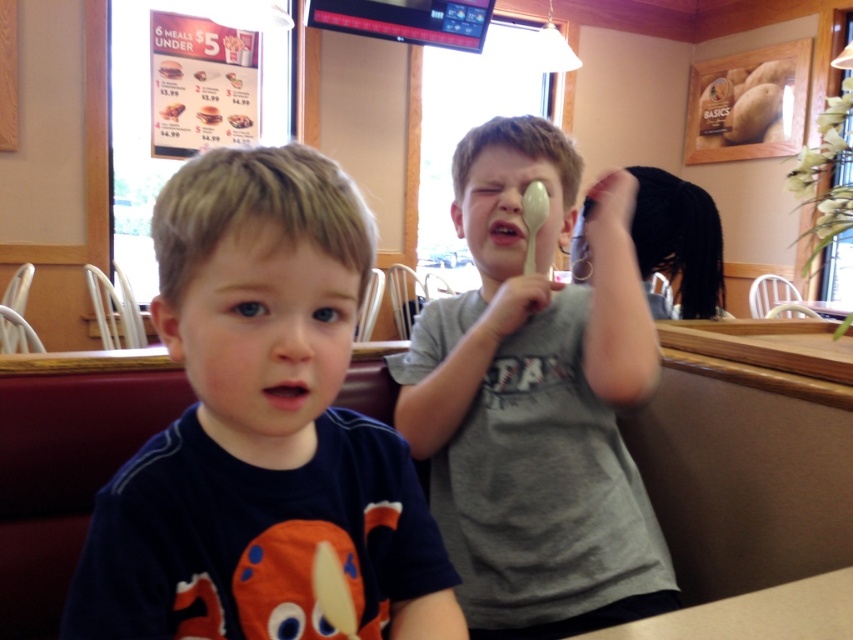
Is white paper cup at upper center positioned in front of matte cardboard menu at upper left?

No, it is behind matte cardboard menu at upper left.

Between white paper cup at upper center and matte cardboard menu at upper left, which one has less height?

matte cardboard menu at upper left

Which is in front, point (216, 116) or point (173, 104)?

Point (173, 104) is in front.

Where is `white paper cup at upper center`? white paper cup at upper center is located at coordinates (207, 115).

Is dark blue t-shirt at center taller than matte cardboard menu at upper left?

Yes, dark blue t-shirt at center is taller than matte cardboard menu at upper left.

Can you confirm if dark blue t-shirt at center is bigger than matte cardboard menu at upper left?

Indeed, dark blue t-shirt at center has a larger size compared to matte cardboard menu at upper left.

In order to click on dark blue t-shirt at center in this screenshot , I will do `click(260, 428)`.

Does point (177, 68) come farther from viewer compared to point (235, 45)?

No, (177, 68) is in front of (235, 45).

Is golden crispy chicken at upper left positioned before white paper menu at upper center?

Yes, golden crispy chicken at upper left is closer to the viewer.

What are the coordinates of `golden crispy chicken at upper left` in the screenshot? It's located at (169, 68).